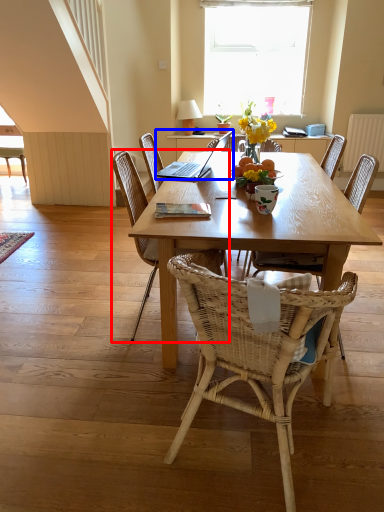
Question: Among these objects, which one is nearest to the camera, chair (highlighted by a red box) or laptop (highlighted by a blue box)?

Choices:
 (A) chair
 (B) laptop

Answer: (A)